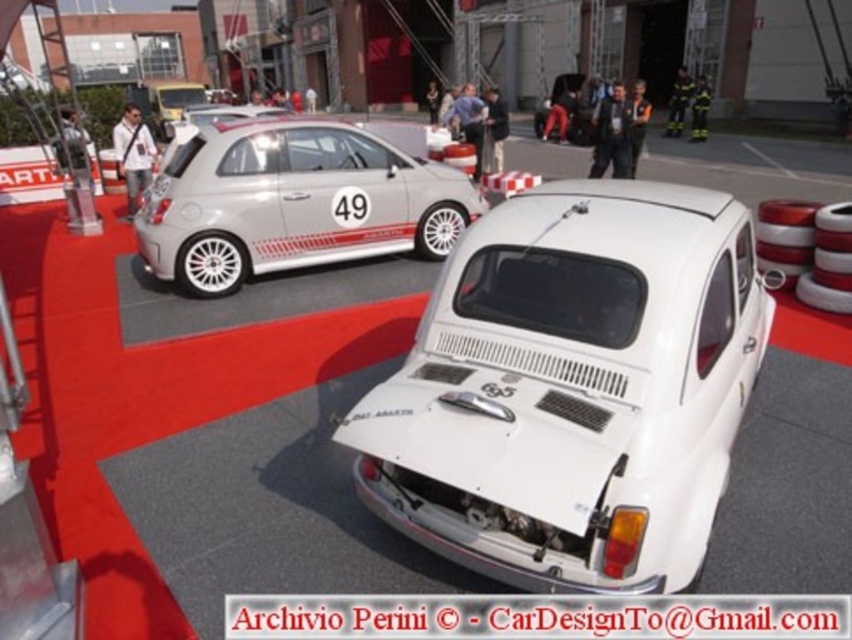
You are an event organizer at the automotive exhibition. You need to ensure that the white matte car at center and the white rubber tire at rear can be moved through a narrow corridor that is exactly 1.2 meters wide. Based on their widths, will both items fit through the corridor simultaneously without overlapping?

The white matte car at center is wider than the white rubber tire at rear. Since the corridor is only 1.2 meters wide, and the car is wider than the tire, it is likely that the car alone may not fit through the corridor. Therefore, both items cannot pass through simultaneously without overlapping.

You are a photographer setting up a shoot for a car magazine. You need to position a white rubber tire at rear so that it appears proportional to the white matte car at center in the photo. Considering their sizes, how should you adjust the tire placement?

The white matte car at center is taller than the white rubber tire at rear. To make them appear proportional in the photo, you should place the white rubber tire at rear closer to the camera to visually increase its size relative to the white matte car at center.